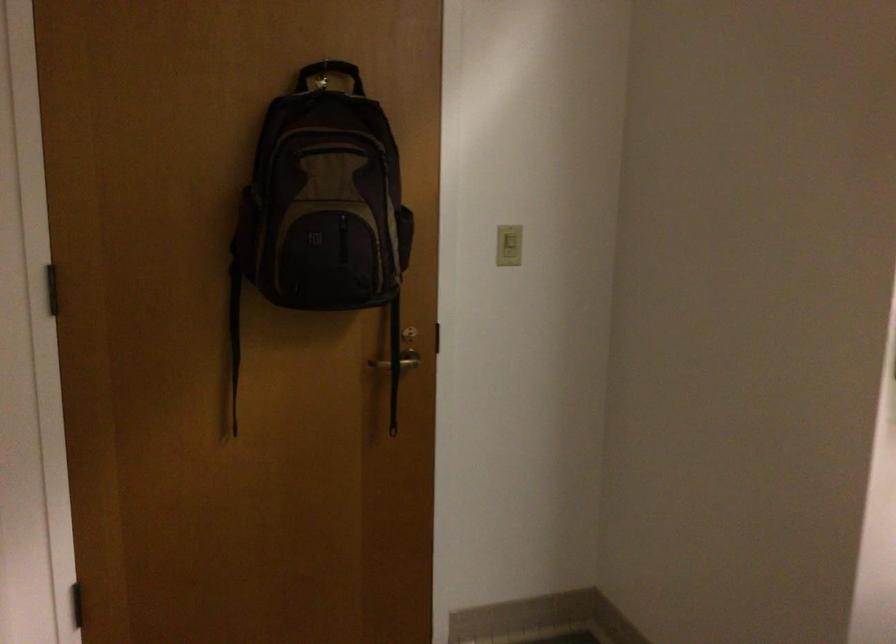
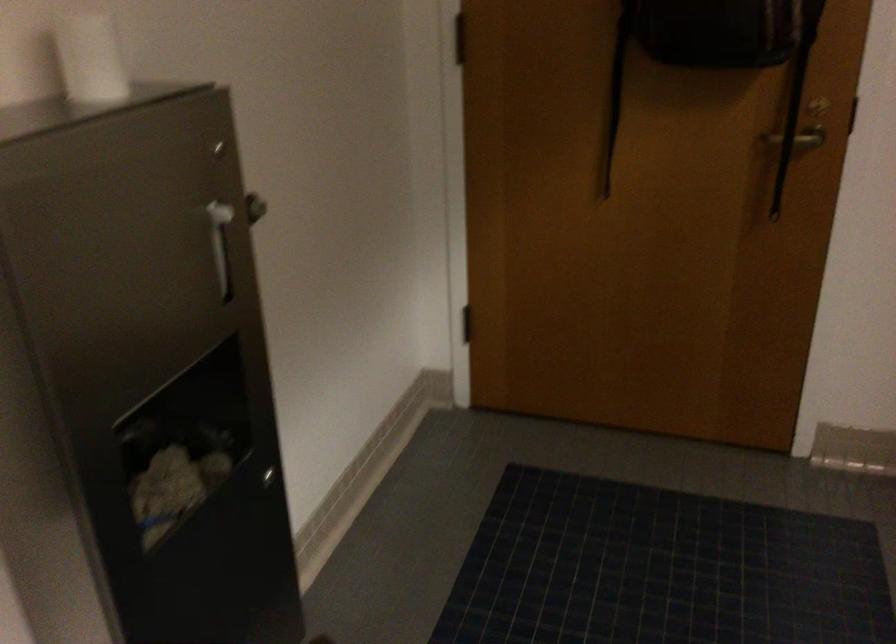
Find the pixel in the second image that matches (x=403, y=368) in the first image.

(798, 138)